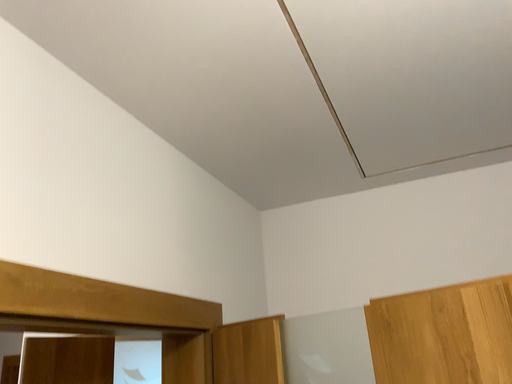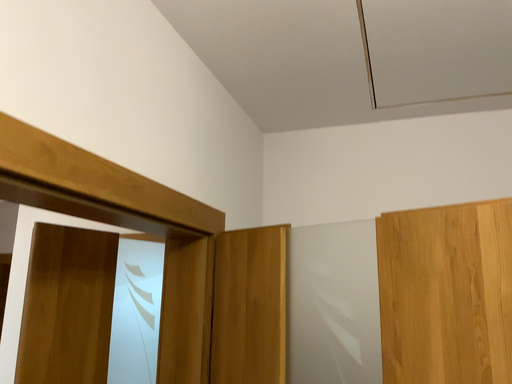
Question: How did the camera likely rotate when shooting the video?

Choices:
 (A) rotated downward
 (B) rotated upward

Answer: (A)